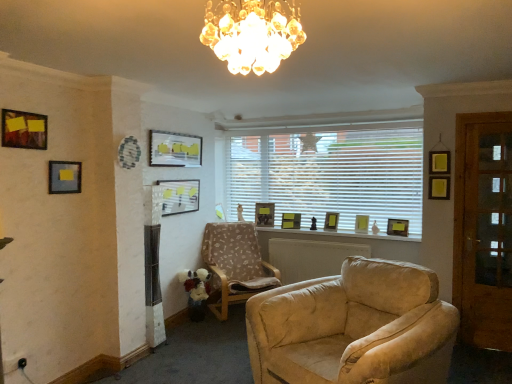
Question: Looking at the image, does matte gold picture frame at center, the seventh picture frame positioned from the left, seem bigger or smaller compared to white blinds at center?

Choices:
 (A) small
 (B) big

Answer: (A)

Question: From their relative heights in the image, would you say matte gold picture frame at center, the 3th picture frame when ordered from right to left, is taller or shorter than white blinds at center?

Choices:
 (A) short
 (B) tall

Answer: (A)

Question: Considering the real-world distances, which object is closest to the matte gold picture frame at center, acting as the first picture frame starting from the back?

Choices:
 (A) wooden glass door at right
 (B) white blinds at center
 (C) matte wooden picture frame at upper left, acting as the 1th picture frame starting from the front
 (D) wooden picture frame at window, acting as the 5th picture frame starting from the front
 (E) matte glass picture frame at upper center, which appears as the third picture frame when viewed from the front

Answer: (B)

Question: Which of these objects is positioned closest to the matte gold picture frame at center, acting as the first picture frame starting from the back?

Choices:
 (A) wooden picture frame at window, marked as the first picture frame in a right-to-left arrangement
 (B) matte wooden picture frame at upper left, marked as the ninth picture frame in a right-to-left arrangement
 (C) matte black picture frame at center, positioned as the 6th picture frame in right-to-left order
 (D) matte glass picture frame at upper center, marked as the third picture frame in a left-to-right arrangement
 (E) matte gold picture frame at center, the 3th picture frame when ordered from right to left

Answer: (E)